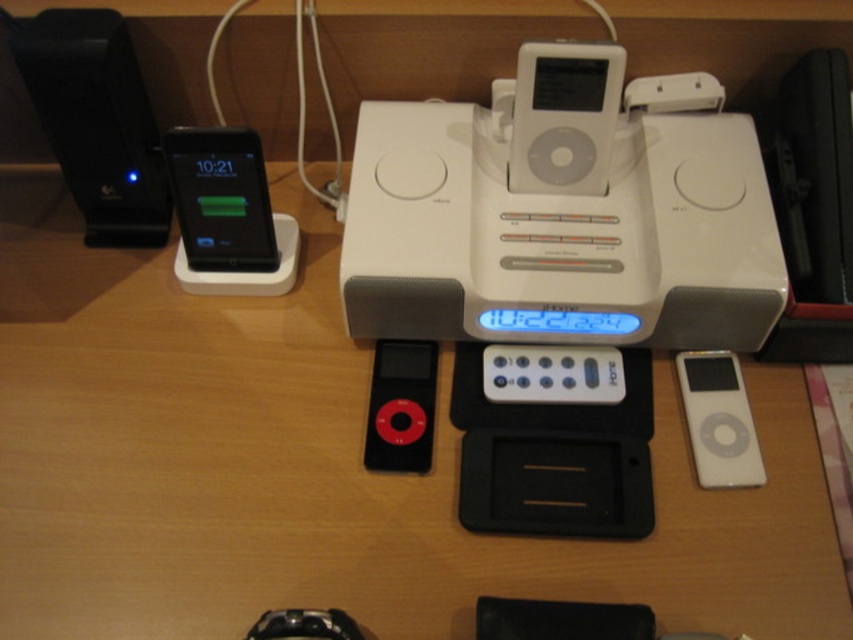
Question: Which object appears closest to the camera in this image?

Choices:
 (A) red matte ipod nano at center
 (B) white plastic stereo at center
 (C) white plastic remote at center

Answer: (B)

Question: Which point is closer to the camera?

Choices:
 (A) (235, 177)
 (B) (601, 352)

Answer: (A)

Question: Does white plastic ipod at right have a lesser width compared to white plastic remote at center?

Choices:
 (A) yes
 (B) no

Answer: (A)

Question: Does white plastic stereo at center appear on the left side of black glossy ipod at left?

Choices:
 (A) no
 (B) yes

Answer: (A)

Question: Which point is farther to the camera?

Choices:
 (A) black glossy ipod at left
 (B) white plastic stereo at center
 (C) black plastic speaker at left
 (D) red matte ipod nano at center

Answer: (D)

Question: Observing the image, what is the correct spatial positioning of white plastic stereo at center in reference to red matte ipod nano at center?

Choices:
 (A) below
 (B) above

Answer: (B)